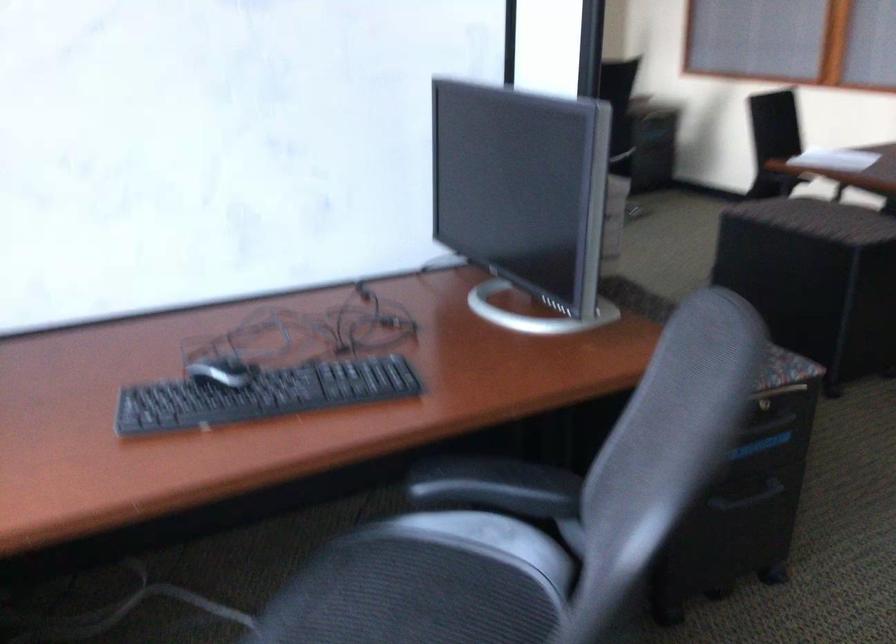
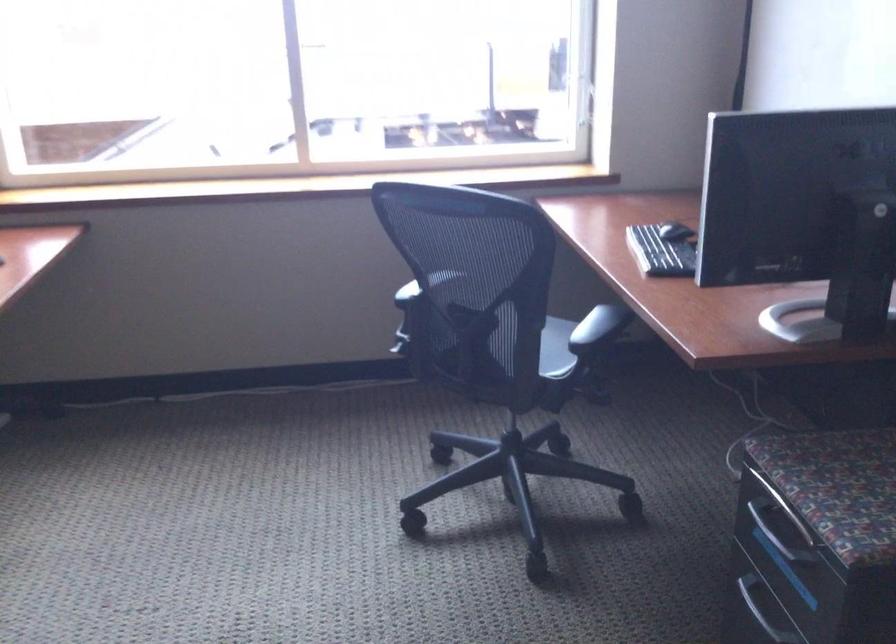
Locate, in the second image, the point that corresponds to point (274, 363) in the first image.

(676, 231)